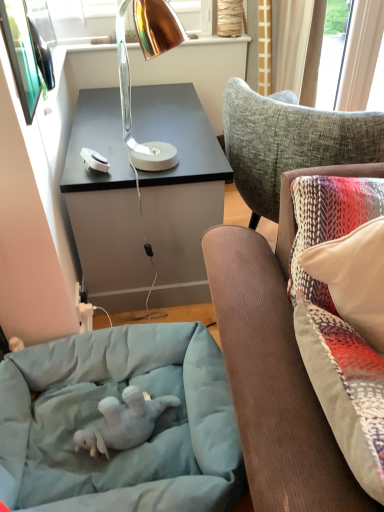
Where is `soft gray plush baby elephant at lower left`? soft gray plush baby elephant at lower left is located at coordinates (123, 422).

You are a GUI agent. You are given a task and a screenshot of the screen. Output one action in this format:
    pyautogui.click(x=<x>, y=<y>)
    Task: Click on the copper metallic desk lamp at upper center
    This screenshot has width=384, height=512.
    Given the screenshot: What is the action you would take?
    pyautogui.click(x=130, y=113)

Where is `lamp that is on the left side of suede couch cushion at right`? This screenshot has width=384, height=512. lamp that is on the left side of suede couch cushion at right is located at coordinates (130, 113).

Consider the image. Considering the sizes of objects suede couch cushion at right and copper metallic desk lamp at upper center in the image provided, who is smaller, suede couch cushion at right or copper metallic desk lamp at upper center?

With smaller size is copper metallic desk lamp at upper center.

Does point (220, 261) come behind point (177, 35)?

No, (220, 261) is in front of (177, 35).

The image size is (384, 512). What are the coordinates of `dog bed lying on the left of copper metallic desk lamp at upper center` in the screenshot? It's located at (102, 419).

Is point (31, 386) closer or farther from the camera than point (161, 147)?

Point (31, 386).

From a real-world perspective, does light blue fabric dog bed at lower left sit lower than copper metallic desk lamp at upper center?

Yes, from a real-world perspective, light blue fabric dog bed at lower left is below copper metallic desk lamp at upper center.

Could copper metallic desk lamp at upper center be considered to be inside light blue fabric dog bed at lower left?

Definitely not — copper metallic desk lamp at upper center is not inside light blue fabric dog bed at lower left.

From the image's perspective, between copper metallic desk lamp at upper center and light blue fabric dog bed at lower left, which one is located above?

From the image's view, copper metallic desk lamp at upper center is above.

Is copper metallic desk lamp at upper center looking in the opposite direction of light blue fabric dog bed at lower left?

copper metallic desk lamp at upper center does not have its back to light blue fabric dog bed at lower left.

Can you tell me how much copper metallic desk lamp at upper center and light blue fabric dog bed at lower left differ in facing direction?

The angle between the facing direction of copper metallic desk lamp at upper center and the facing direction of light blue fabric dog bed at lower left is 85.4 degrees.

From their relative heights in the image, would you say copper metallic desk lamp at upper center is taller or shorter than light blue fabric dog bed at lower left?

Clearly, copper metallic desk lamp at upper center is taller compared to light blue fabric dog bed at lower left.

Does point (172, 27) lie in front of point (110, 400)?

Yes, it is in front of point (110, 400).

From a real-world perspective, does copper metallic desk lamp at upper center stand above soft gray plush baby elephant at lower left?

Correct, in the physical world, copper metallic desk lamp at upper center is higher than soft gray plush baby elephant at lower left.

Is copper metallic desk lamp at upper center oriented towards soft gray plush baby elephant at lower left?

No, copper metallic desk lamp at upper center is not aimed at soft gray plush baby elephant at lower left.

From the image's perspective, is copper metallic desk lamp at upper center over soft gray plush baby elephant at lower left?

Yes, from the image's perspective, copper metallic desk lamp at upper center is above soft gray plush baby elephant at lower left.

The width and height of the screenshot is (384, 512). I want to click on dog bed that is below the suede couch cushion at right (from the image's perspective), so click(102, 419).

Considering the sizes of light blue fabric dog bed at lower left and suede couch cushion at right in the image, is light blue fabric dog bed at lower left wider or thinner than suede couch cushion at right?

In the image, light blue fabric dog bed at lower left appears to be wider than suede couch cushion at right.

What's the angular difference between light blue fabric dog bed at lower left and suede couch cushion at right's facing directions?

The angular difference between light blue fabric dog bed at lower left and suede couch cushion at right is 82.8 degrees.

In the scene shown: Between light blue fabric dog bed at lower left and suede couch cushion at right, which one appears on the left side from the viewer's perspective?

light blue fabric dog bed at lower left is more to the left.

Based on the photo, considering the sizes of copper metallic desk lamp at upper center and suede couch cushion at right in the image, is copper metallic desk lamp at upper center wider or thinner than suede couch cushion at right?

In the image, copper metallic desk lamp at upper center appears to be more narrow than suede couch cushion at right.

Is point (142, 47) positioned behind point (247, 280)?

Yes, point (142, 47) is farther from viewer.

From the picture: Considering the relative sizes of copper metallic desk lamp at upper center and suede couch cushion at right in the image provided, is copper metallic desk lamp at upper center taller than suede couch cushion at right?

No, copper metallic desk lamp at upper center is not taller than suede couch cushion at right.

Consider the image. Is suede couch cushion at right at the back of copper metallic desk lamp at upper center?

No, copper metallic desk lamp at upper center is not facing away from suede couch cushion at right.

Is soft gray plush baby elephant at lower left not close to suede couch cushion at right?

No, there isn't a large distance between soft gray plush baby elephant at lower left and suede couch cushion at right.

Which of these two, soft gray plush baby elephant at lower left or suede couch cushion at right, is wider?

suede couch cushion at right.

Does soft gray plush baby elephant at lower left have a greater height compared to suede couch cushion at right?

Incorrect, the height of soft gray plush baby elephant at lower left is not larger of that of suede couch cushion at right.

Is soft gray plush baby elephant at lower left aimed at suede couch cushion at right?

No, soft gray plush baby elephant at lower left does not turn towards suede couch cushion at right.

What are the coordinates of `lamp that is behind the suede couch cushion at right` in the screenshot? It's located at (130, 113).

Identify the location of dog bed that is on the left side of copper metallic desk lamp at upper center. Image resolution: width=384 pixels, height=512 pixels. (102, 419).

Based on the photo, based on their spatial positions, is suede couch cushion at right or light blue fabric dog bed at lower left further from copper metallic desk lamp at upper center?

light blue fabric dog bed at lower left.

Looking at this image, which object lies further to the anchor point soft gray plush baby elephant at lower left, copper metallic desk lamp at upper center or light blue fabric dog bed at lower left?

copper metallic desk lamp at upper center lies further to soft gray plush baby elephant at lower left than the other object.

Based on their spatial positions, is copper metallic desk lamp at upper center or light blue fabric dog bed at lower left further from suede couch cushion at right?

copper metallic desk lamp at upper center lies further to suede couch cushion at right than the other object.

From the image, which object appears to be nearer to suede couch cushion at right, soft gray plush baby elephant at lower left or copper metallic desk lamp at upper center?

Based on the image, soft gray plush baby elephant at lower left appears to be nearer to suede couch cushion at right.

Which object lies further to the anchor point soft gray plush baby elephant at lower left, suede couch cushion at right or light blue fabric dog bed at lower left?

Among the two, suede couch cushion at right is located further to soft gray plush baby elephant at lower left.

Which object lies nearer to the anchor point copper metallic desk lamp at upper center, suede couch cushion at right or soft gray plush baby elephant at lower left?

Based on the image, suede couch cushion at right appears to be nearer to copper metallic desk lamp at upper center.

Based on their spatial positions, is light blue fabric dog bed at lower left or soft gray plush baby elephant at lower left further from suede couch cushion at right?

soft gray plush baby elephant at lower left is positioned further to the anchor suede couch cushion at right.

Estimate the real-world distances between objects in this image. Which object is closer to soft gray plush baby elephant at lower left, copper metallic desk lamp at upper center or suede couch cushion at right?

The object closer to soft gray plush baby elephant at lower left is suede couch cushion at right.

Locate an element on the screen. This screenshot has width=384, height=512. studio couch between copper metallic desk lamp at upper center and soft gray plush baby elephant at lower left in the vertical direction is located at coordinates (276, 367).

Find the location of `dog bed between suede couch cushion at right and soft gray plush baby elephant at lower left from front to back`. dog bed between suede couch cushion at right and soft gray plush baby elephant at lower left from front to back is located at coordinates (102, 419).

Where is `studio couch between copper metallic desk lamp at upper center and light blue fabric dog bed at lower left vertically`? studio couch between copper metallic desk lamp at upper center and light blue fabric dog bed at lower left vertically is located at coordinates (276, 367).

Where is `dog bed between copper metallic desk lamp at upper center and soft gray plush baby elephant at lower left from top to bottom`? Image resolution: width=384 pixels, height=512 pixels. dog bed between copper metallic desk lamp at upper center and soft gray plush baby elephant at lower left from top to bottom is located at coordinates (102, 419).